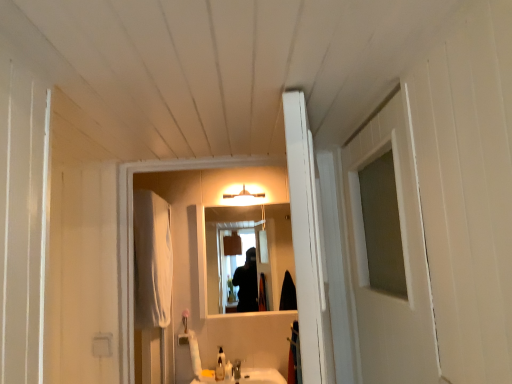
Question: Could matte white light fixture at upper center be considered to be inside satin nickel faucet at lower center?

Choices:
 (A) no
 (B) yes

Answer: (A)

Question: From the image's perspective, is satin nickel faucet at lower center under matte white light fixture at upper center?

Choices:
 (A) yes
 (B) no

Answer: (A)

Question: From a real-world perspective, is satin nickel faucet at lower center over matte white light fixture at upper center?

Choices:
 (A) yes
 (B) no

Answer: (B)

Question: Does satin nickel faucet at lower center have a larger size compared to matte white light fixture at upper center?

Choices:
 (A) yes
 (B) no

Answer: (B)

Question: Does satin nickel faucet at lower center have a smaller size compared to matte white light fixture at upper center?

Choices:
 (A) yes
 (B) no

Answer: (A)

Question: Looking at their shapes, would you say white fabric curtain at left is wider or thinner than satin nickel faucet at lower center?

Choices:
 (A) thin
 (B) wide

Answer: (B)

Question: Based on their sizes in the image, would you say white fabric curtain at left is bigger or smaller than satin nickel faucet at lower center?

Choices:
 (A) big
 (B) small

Answer: (A)

Question: In the image, is white fabric curtain at left on the left side or the right side of satin nickel faucet at lower center?

Choices:
 (A) right
 (B) left

Answer: (B)

Question: From the image's perspective, is white fabric curtain at left above or below satin nickel faucet at lower center?

Choices:
 (A) above
 (B) below

Answer: (A)

Question: In terms of size, does clear glass mirror at center appear bigger or smaller than white fabric curtain at left?

Choices:
 (A) small
 (B) big

Answer: (A)

Question: From the image's perspective, relative to white fabric curtain at left, is clear glass mirror at center above or below?

Choices:
 (A) above
 (B) below

Answer: (B)

Question: Is clear glass mirror at center in front of or behind white fabric curtain at left in the image?

Choices:
 (A) behind
 (B) front

Answer: (A)

Question: Would you say clear glass mirror at center is inside or outside white fabric curtain at left?

Choices:
 (A) inside
 (B) outside

Answer: (B)

Question: In the image, is translucent glass bottle at lower center positioned in front of or behind translucent plastic soap at center?

Choices:
 (A) behind
 (B) front

Answer: (A)

Question: Is point (217, 375) closer or farther from the camera than point (230, 370)?

Choices:
 (A) closer
 (B) farther

Answer: (A)